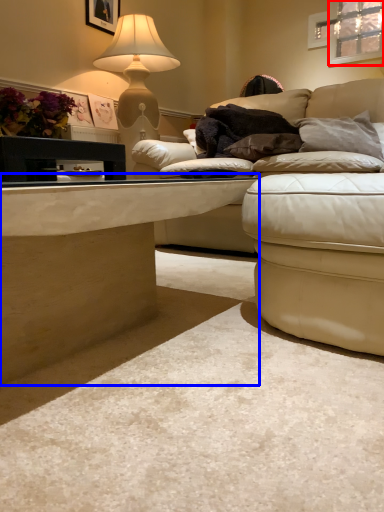
Question: Which object appears closest to the camera in this image, window (highlighted by a red box) or table (highlighted by a blue box)?

Choices:
 (A) window
 (B) table

Answer: (B)